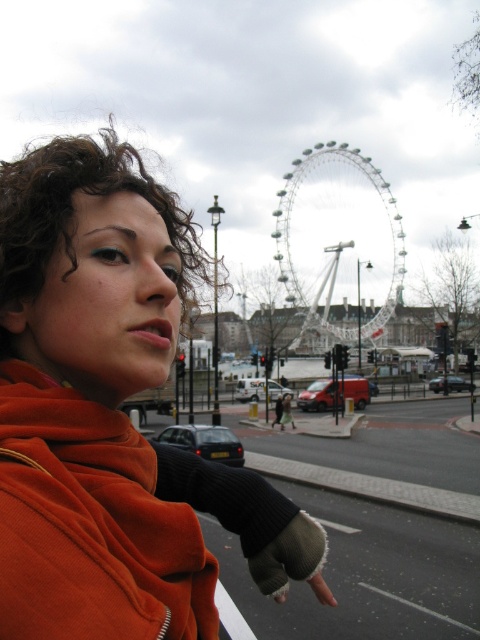
Question: Is orange fleece jacket at center above white metallic ferris wheel at center?

Choices:
 (A) no
 (B) yes

Answer: (A)

Question: Among these points, which one is nearest to the camera?

Choices:
 (A) (364, 321)
 (B) (85, 634)

Answer: (B)

Question: Is orange fleece jacket at center to the left of white metallic ferris wheel at center from the viewer's perspective?

Choices:
 (A) no
 (B) yes

Answer: (B)

Question: Observing the image, what is the correct spatial positioning of orange fleece jacket at center in reference to white metallic ferris wheel at center?

Choices:
 (A) below
 (B) above

Answer: (A)

Question: Which of the following is the farthest from the observer?

Choices:
 (A) (84, 632)
 (B) (279, 250)

Answer: (B)

Question: Which point is closer to the camera taking this photo?

Choices:
 (A) (124, 364)
 (B) (328, 150)

Answer: (A)